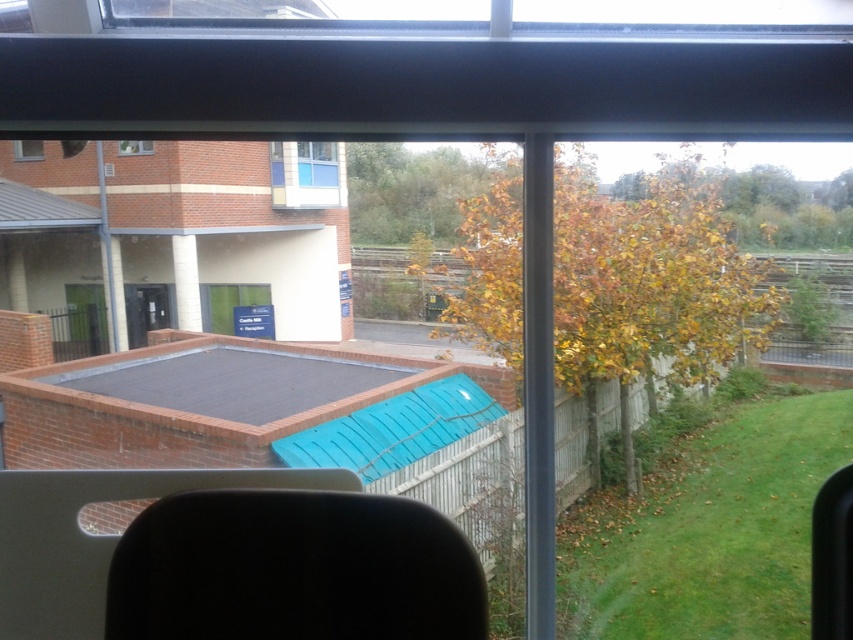
Question: Among these points, which one is farthest from the camera?

Choices:
 (A) pos(32,154)
 (B) pos(303,208)

Answer: (B)

Question: Does white plastic window at center lie behind clear glass window at center?

Choices:
 (A) yes
 (B) no

Answer: (B)

Question: Does clear glass window at center appear under clear glass window at upper left?

Choices:
 (A) no
 (B) yes

Answer: (A)

Question: Can you confirm if white plastic window at center is positioned to the left of clear glass window at upper left?

Choices:
 (A) no
 (B) yes

Answer: (A)

Question: Among these objects, which one is nearest to the camera?

Choices:
 (A) clear glass window at center
 (B) white plastic window at center
 (C) clear glass window at upper left
 (D) clear glass window at upper center

Answer: (B)

Question: Which of the following is the closest to the observer?

Choices:
 (A) (15, 145)
 (B) (322, 176)
 (C) (270, 164)
 (D) (144, 147)

Answer: (D)